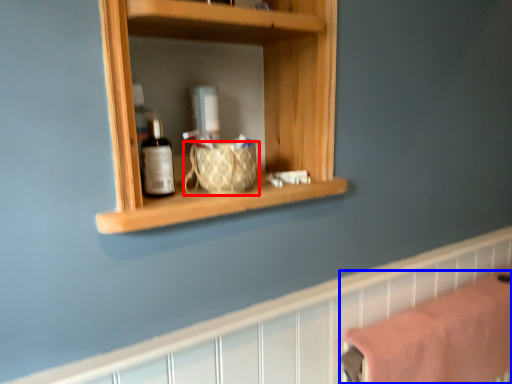
Question: Which point is further to the camera, basket (highlighted by a red box) or bath towel (highlighted by a blue box)?

Choices:
 (A) basket
 (B) bath towel

Answer: (B)